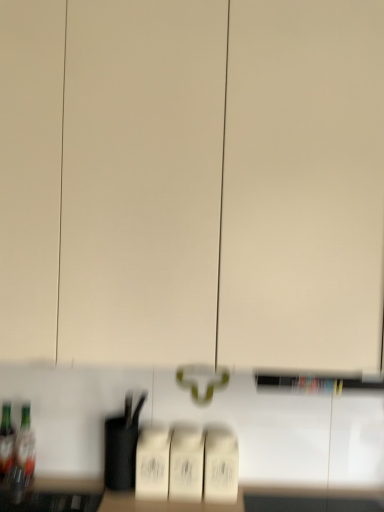
Question: Is the surface of translucent glass bottle at lower left, the 2th bottle when ordered from right to left, in direct contact with translucent glass bottle at lower left, the second bottle when ordered from left to right?

Choices:
 (A) yes
 (B) no

Answer: (A)

Question: Considering the relative sizes of translucent glass bottle at lower left, the 2th bottle when ordered from right to left, and translucent glass bottle at lower left, the second bottle when ordered from left to right, in the image provided, is translucent glass bottle at lower left, the 2th bottle when ordered from right to left, wider than translucent glass bottle at lower left, the second bottle when ordered from left to right,?

Choices:
 (A) yes
 (B) no

Answer: (A)

Question: Does translucent glass bottle at lower left, acting as the 1th bottle starting from the left, appear on the left side of translucent glass bottle at lower left, the second bottle when ordered from left to right?

Choices:
 (A) no
 (B) yes

Answer: (B)

Question: Does translucent glass bottle at lower left, acting as the 1th bottle starting from the left, lie in front of translucent glass bottle at lower left, which ranks as the 1th bottle in right-to-left order?

Choices:
 (A) no
 (B) yes

Answer: (A)

Question: Are translucent glass bottle at lower left, acting as the 1th bottle starting from the left, and translucent glass bottle at lower left, which ranks as the 1th bottle in right-to-left order, located far from each other?

Choices:
 (A) no
 (B) yes

Answer: (A)

Question: Is translucent glass bottle at lower left, acting as the 1th bottle starting from the left, oriented towards translucent glass bottle at lower left, which ranks as the 1th bottle in right-to-left order?

Choices:
 (A) no
 (B) yes

Answer: (A)

Question: Is translucent glass bottle at lower left, which ranks as the 1th bottle in right-to-left order, completely or partially outside of translucent glass bottle at lower left, acting as the 1th bottle starting from the left?

Choices:
 (A) yes
 (B) no

Answer: (A)

Question: Would you say translucent glass bottle at lower left, the second bottle when ordered from left to right, contains translucent glass bottle at lower left, acting as the 1th bottle starting from the left?

Choices:
 (A) yes
 (B) no

Answer: (B)

Question: Does translucent glass bottle at lower left, which ranks as the 1th bottle in right-to-left order, have a lesser width compared to translucent glass bottle at lower left, the 2th bottle when ordered from right to left?

Choices:
 (A) yes
 (B) no

Answer: (A)

Question: Does translucent glass bottle at lower left, the second bottle when ordered from left to right, lie behind translucent glass bottle at lower left, the 2th bottle when ordered from right to left?

Choices:
 (A) yes
 (B) no

Answer: (B)

Question: Does translucent glass bottle at lower left, which ranks as the 1th bottle in right-to-left order, have a larger size compared to translucent glass bottle at lower left, the 2th bottle when ordered from right to left?

Choices:
 (A) yes
 (B) no

Answer: (A)

Question: Is translucent glass bottle at lower left, the second bottle when ordered from left to right, beside translucent glass bottle at lower left, acting as the 1th bottle starting from the left?

Choices:
 (A) no
 (B) yes

Answer: (B)

Question: Is translucent glass bottle at lower left, which ranks as the 1th bottle in right-to-left order, inside the boundaries of translucent glass bottle at lower left, acting as the 1th bottle starting from the left, or outside?

Choices:
 (A) inside
 (B) outside

Answer: (B)